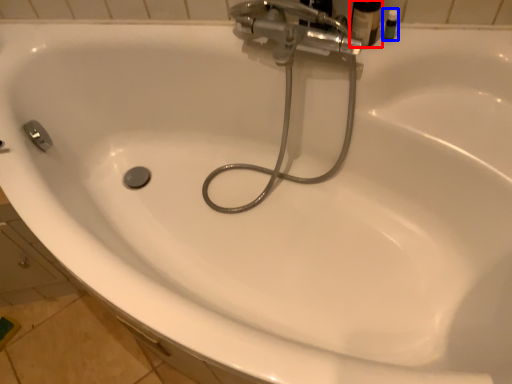
Question: Which object is further to the camera taking this photo, toiletry (highlighted by a red box) or toiletry (highlighted by a blue box)?

Choices:
 (A) toiletry
 (B) toiletry

Answer: (B)